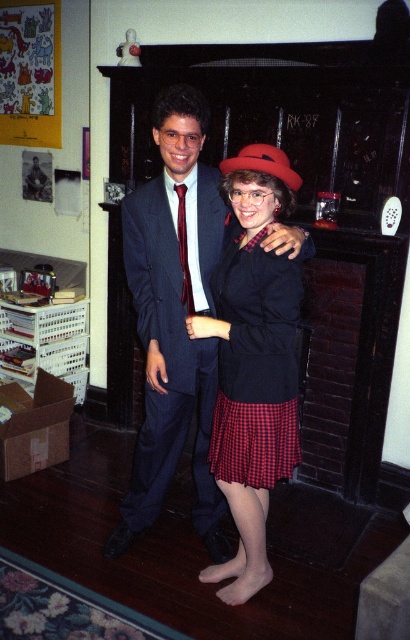
Looking at this image, how far apart are matte black suit at center and dark blue wool suit at center?

matte black suit at center and dark blue wool suit at center are 1.11 inches apart.

You are a GUI agent. You are given a task and a screenshot of the screen. Output one action in this format:
    pyautogui.click(x=<x>, y=<y>)
    Task: Click on the matte black suit at center
    The height and width of the screenshot is (640, 410).
    Given the screenshot: What is the action you would take?
    pyautogui.click(x=173, y=320)

Which is in front, point (159, 308) or point (132, 280)?

Point (159, 308) is more forward.

Locate an element on the screen. This screenshot has height=640, width=410. matte black suit at center is located at coordinates (173, 320).

Between red checkered skirt at center and burgundy silk tie at center, which one has less height?

burgundy silk tie at center is shorter.

Does red checkered skirt at center come behind burgundy silk tie at center?

No, red checkered skirt at center is closer to the viewer.

Image resolution: width=410 pixels, height=640 pixels. Find the location of `red checkered skirt at center`. red checkered skirt at center is located at coordinates (255, 365).

Is point (195, 97) less distant than point (186, 266)?

Yes.

Who is taller, matte black suit at center or burgundy silk tie at center?

matte black suit at center is taller.

What do you see at coordinates (173, 320) in the screenshot? Image resolution: width=410 pixels, height=640 pixels. I see `matte black suit at center` at bounding box center [173, 320].

Identify the location of matte black suit at center. This screenshot has height=640, width=410. (173, 320).